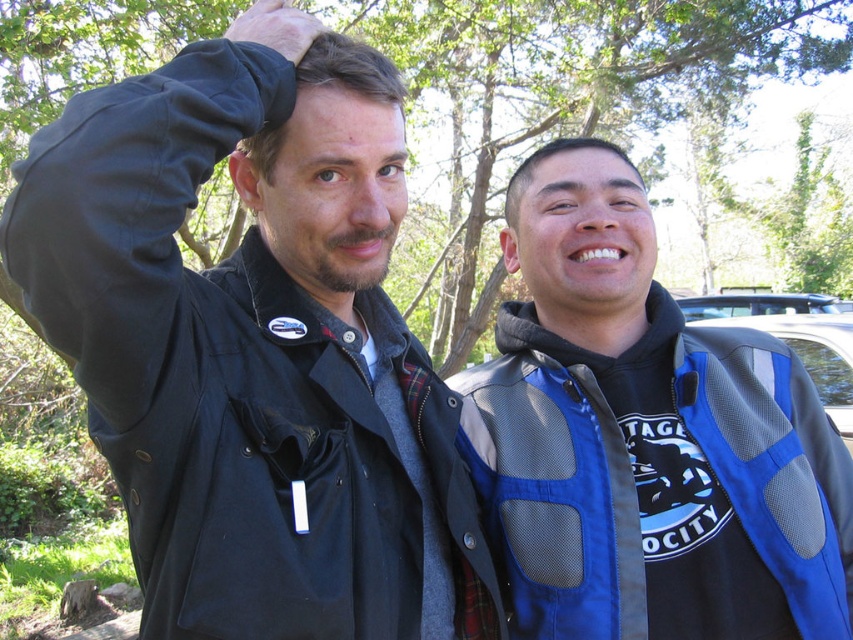
You are standing at the origin point in the image and want to move towards the two points labeled as point (379, 522) and point (498, 461). Which point should you reach first if you move straight ahead?

Point (379, 522) is in front of point (498, 461), so you should reach point (379, 522) first when moving straight ahead.